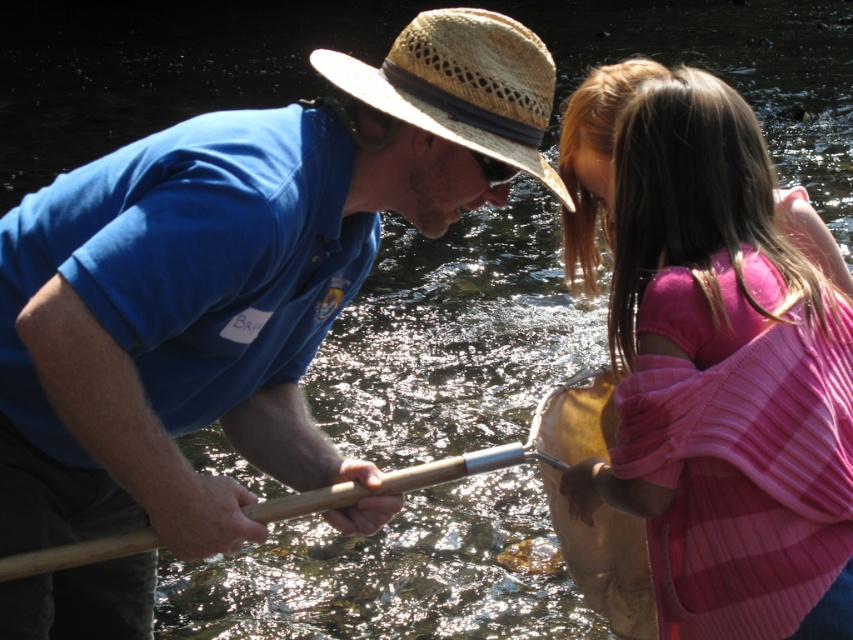
You are a photographer taking a picture of the pink ribbed sweater at upper right and the wooden paddle at center. Which object should you zoom in on to make them appear the same size in the photo?

The photographer should zoom in on the pink ribbed sweater at upper right because it is larger than the wooden paddle at center, so zooming in on it will make both appear the same size in the photo.